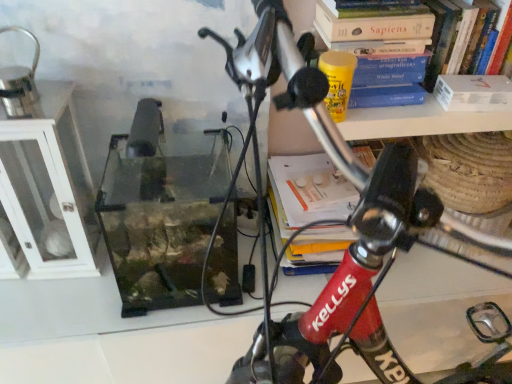
Question: Can you confirm if hardcover book at upper right, positioned as the first book in right-to-left order, is positioned to the right of white glass cabinet at left?

Choices:
 (A) yes
 (B) no

Answer: (A)

Question: Is hardcover book at upper right, which is the second book in left-to-right order, further to camera compared to white glass cabinet at left?

Choices:
 (A) yes
 (B) no

Answer: (A)

Question: Considering the relative sizes of hardcover book at upper right, which is the second book in left-to-right order, and white glass cabinet at left in the image provided, is hardcover book at upper right, which is the second book in left-to-right order, wider than white glass cabinet at left?

Choices:
 (A) no
 (B) yes

Answer: (A)

Question: Can you confirm if hardcover book at upper right, positioned as the first book in right-to-left order, is taller than white glass cabinet at left?

Choices:
 (A) yes
 (B) no

Answer: (B)

Question: Can you confirm if hardcover book at upper right, positioned as the first book in right-to-left order, is thinner than white glass cabinet at left?

Choices:
 (A) yes
 (B) no

Answer: (A)

Question: Is hardcover book at upper right, positioned as the first book in right-to-left order, taller or shorter than hardcover book at upper right, positioned as the 2th book in right-to-left order?

Choices:
 (A) short
 (B) tall

Answer: (B)

Question: In the image, is hardcover book at upper right, positioned as the first book in right-to-left order, positioned in front of or behind hardcover book at upper right, positioned as the 2th book in right-to-left order?

Choices:
 (A) front
 (B) behind

Answer: (B)

Question: Is hardcover book at upper right, which is the second book in left-to-right order, inside the boundaries of hardcover book at upper right, positioned as the 2th book in right-to-left order, or outside?

Choices:
 (A) inside
 (B) outside

Answer: (B)

Question: In the image, is hardcover book at upper right, which is the second book in left-to-right order, on the left side or the right side of hardcover book at upper right, which is the first book from left to right?

Choices:
 (A) right
 (B) left

Answer: (A)

Question: Looking at their shapes, would you say white matte paperback book at upper right is wider or thinner than hardcover book at upper right, positioned as the 2th book in right-to-left order?

Choices:
 (A) thin
 (B) wide

Answer: (A)

Question: Is white matte paperback book at upper right taller or shorter than hardcover book at upper right, which is the first book from left to right?

Choices:
 (A) short
 (B) tall

Answer: (A)

Question: Based on their positions, is white matte paperback book at upper right located to the left or right of hardcover book at upper right, positioned as the 2th book in right-to-left order?

Choices:
 (A) left
 (B) right

Answer: (B)

Question: Considering their positions, is white matte paperback book at upper right located in front of or behind hardcover book at upper right, which is the first book from left to right?

Choices:
 (A) behind
 (B) front

Answer: (A)

Question: Is white matte paperback book at upper right bigger or smaller than white glass cabinet at left?

Choices:
 (A) big
 (B) small

Answer: (B)

Question: Looking at their shapes, would you say white matte paperback book at upper right is wider or thinner than white glass cabinet at left?

Choices:
 (A) wide
 (B) thin

Answer: (B)